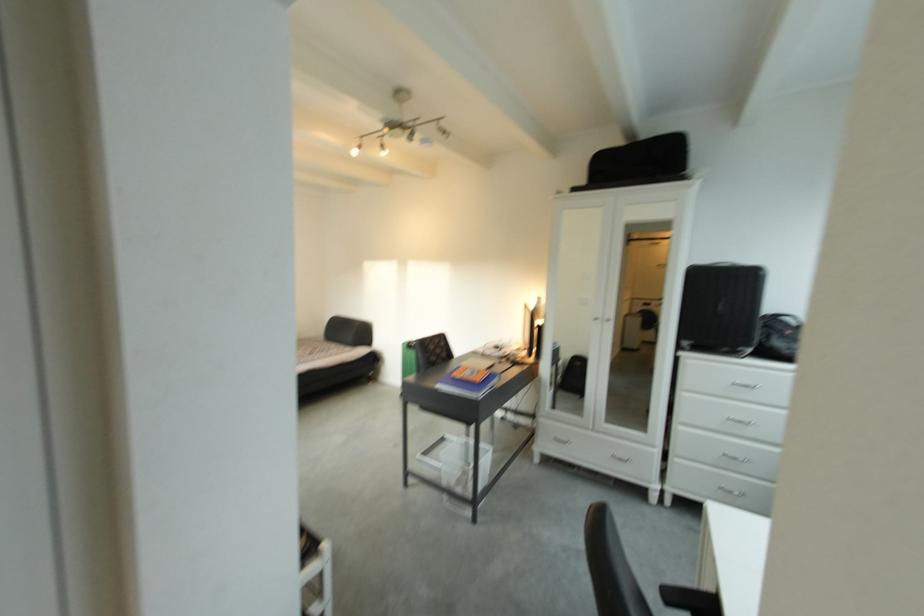
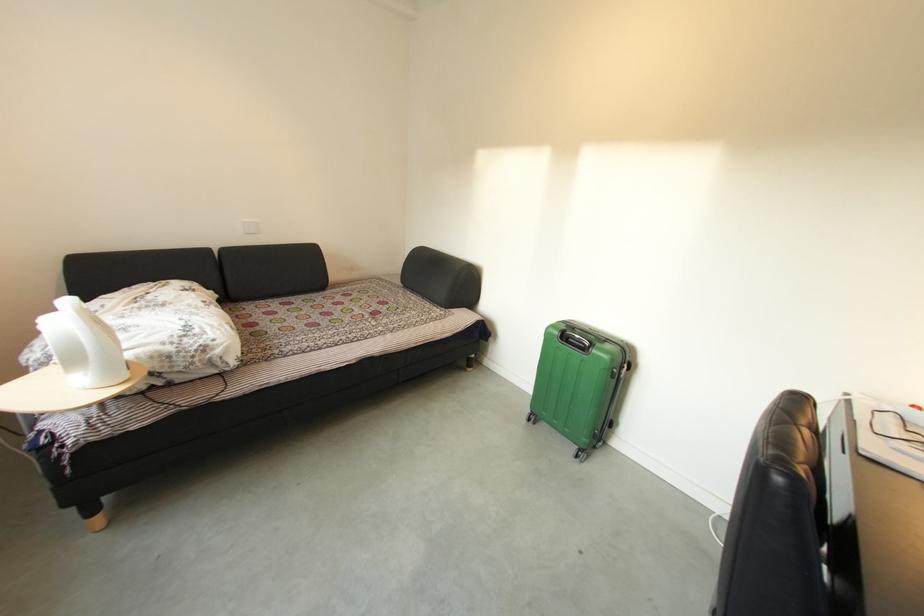
What movement of the cameraman would produce the second image?

The cameraman walked toward left, forward.